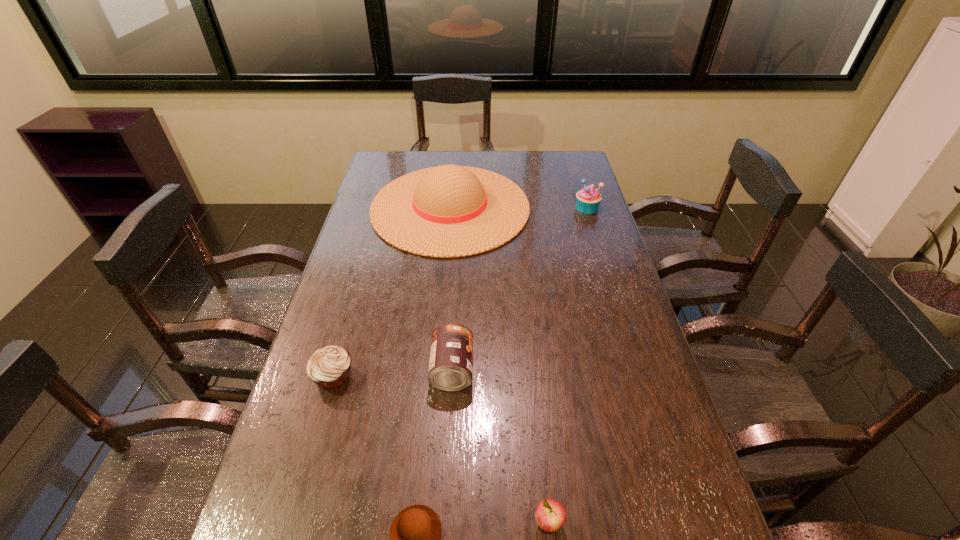
Identify the location of the tallest object. (450, 211).

You are a GUI agent. You are given a task and a screenshot of the screen. Output one action in this format:
    pyautogui.click(x=<x>, y=<y>)
    Task: Click on the farthest muffin
    This screenshot has width=960, height=540.
    Given the screenshot: What is the action you would take?
    pyautogui.click(x=588, y=199)

Identify the location of the tallest muffin. Image resolution: width=960 pixels, height=540 pixels. pos(588,199).

Identify the location of can. This screenshot has width=960, height=540. (451, 357).

Locate an element on the screen. the second nearest muffin is located at coordinates (329, 367).

You are a GUI agent. You are given a task and a screenshot of the screen. Output one action in this format:
    pyautogui.click(x=<x>, y=<y>)
    Task: Click on the leftmost muffin
    The image size is (960, 540).
    Given the screenshot: What is the action you would take?
    pyautogui.click(x=329, y=367)

Image resolution: width=960 pixels, height=540 pixels. I want to click on apple, so click(x=550, y=515).

The height and width of the screenshot is (540, 960). I want to click on free spot located on the front of the tallest object, so click(438, 352).

This screenshot has width=960, height=540. What are the coordinates of `vacant space positioned 0.150m on the front of the rightmost muffin` in the screenshot? It's located at (597, 240).

The image size is (960, 540). I want to click on vacant region located on the front label of the can, so click(x=551, y=369).